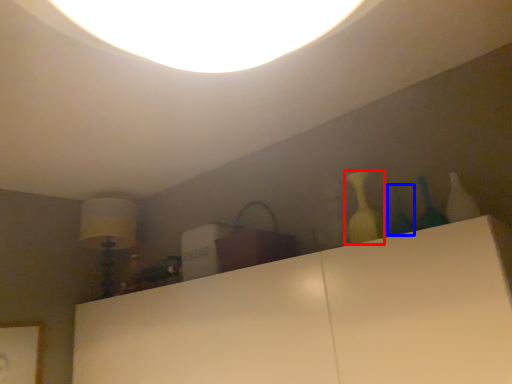
Question: Among these objects, which one is farthest to the camera, bottle (highlighted by a red box) or glass vase (highlighted by a blue box)?

Choices:
 (A) bottle
 (B) glass vase

Answer: (A)